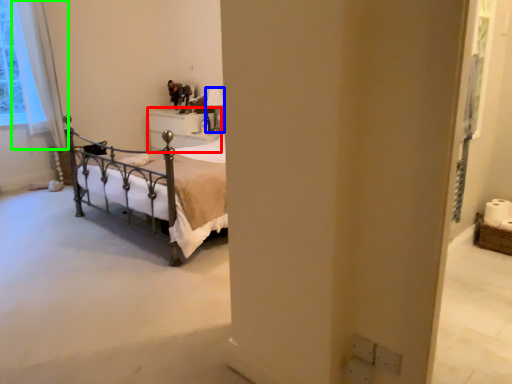
Question: Considering the real-world distances, which object is farthest from furniture (highlighted by a red box)? lamp (highlighted by a blue box) or curtain (highlighted by a green box)?

Choices:
 (A) lamp
 (B) curtain

Answer: (B)